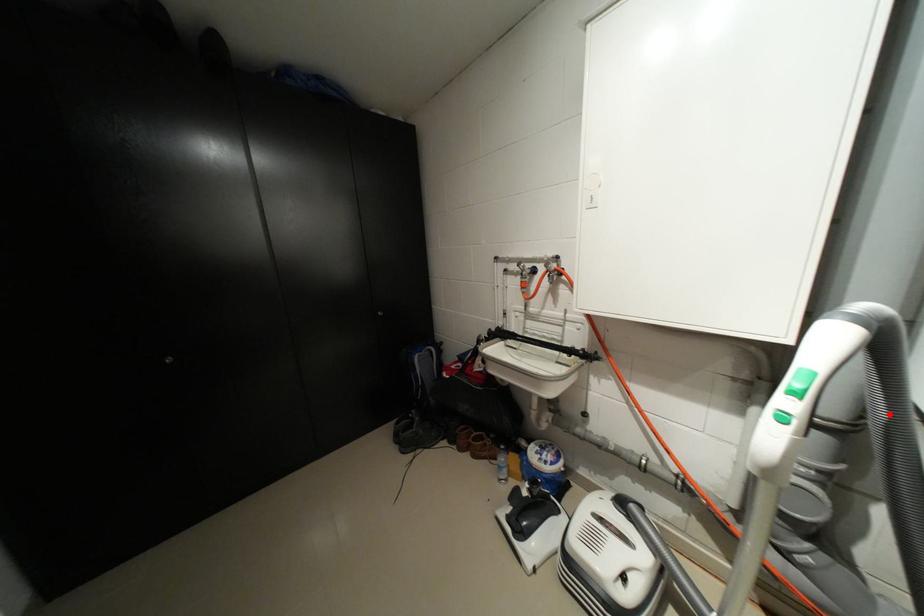
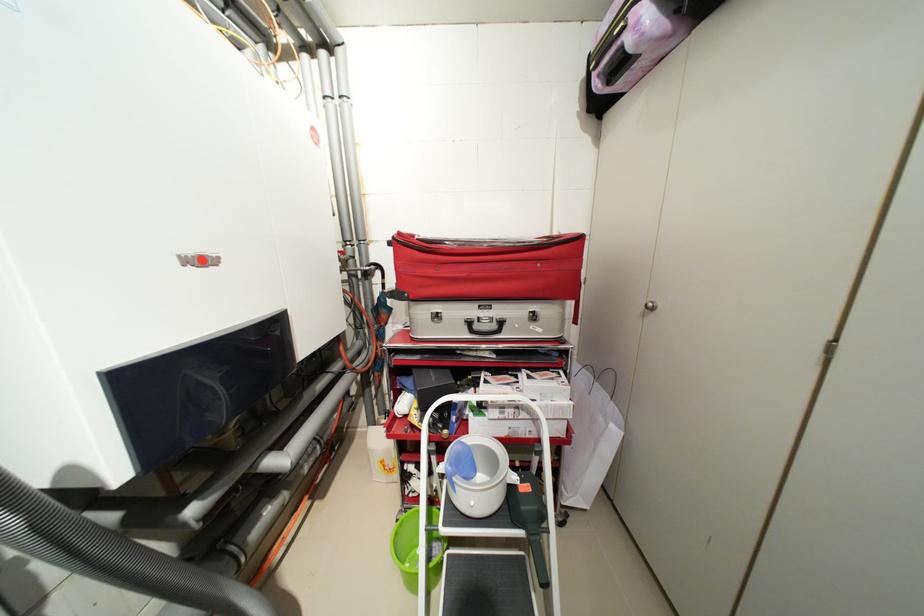
Question: I am providing you with two images of the same scene from different viewpoints. A red point is shown in image1. For the corresponding object point in image2, is it positioned nearer or farther from the camera?

Choices:
 (A) Nearer
 (B) Farther

Answer: (A)